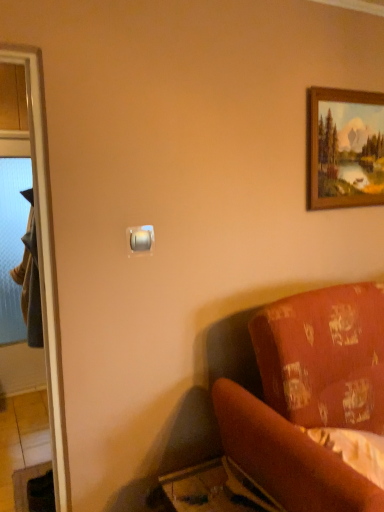
Question: Is satin gold switch at upper center inside dark gray fabric robe at left?

Choices:
 (A) yes
 (B) no

Answer: (B)

Question: Considering the relative sizes of dark gray fabric robe at left and satin gold switch at upper center in the image provided, is dark gray fabric robe at left smaller than satin gold switch at upper center?

Choices:
 (A) yes
 (B) no

Answer: (B)

Question: Is dark gray fabric robe at left at the left side of satin gold switch at upper center?

Choices:
 (A) yes
 (B) no

Answer: (A)

Question: Can you confirm if dark gray fabric robe at left is wider than satin gold switch at upper center?

Choices:
 (A) yes
 (B) no

Answer: (A)

Question: Considering the relative sizes of dark gray fabric robe at left and satin gold switch at upper center in the image provided, is dark gray fabric robe at left bigger than satin gold switch at upper center?

Choices:
 (A) no
 (B) yes

Answer: (B)

Question: Is dark gray fabric robe at left not near satin gold switch at upper center?

Choices:
 (A) yes
 (B) no

Answer: (A)

Question: From the image's perspective, is dark gray fabric robe at left under velvet-like red couch at lower right?

Choices:
 (A) yes
 (B) no

Answer: (B)

Question: Does dark gray fabric robe at left have a smaller size compared to velvet-like red couch at lower right?

Choices:
 (A) no
 (B) yes

Answer: (B)

Question: Is dark gray fabric robe at left completely or partially outside of velvet-like red couch at lower right?

Choices:
 (A) no
 (B) yes

Answer: (B)

Question: From a real-world perspective, is dark gray fabric robe at left positioned under velvet-like red couch at lower right based on gravity?

Choices:
 (A) no
 (B) yes

Answer: (A)

Question: Does dark gray fabric robe at left appear on the left side of velvet-like red couch at lower right?

Choices:
 (A) no
 (B) yes

Answer: (B)

Question: Are dark gray fabric robe at left and velvet-like red couch at lower right far apart?

Choices:
 (A) no
 (B) yes

Answer: (B)

Question: Considering the relative positions of velvet-like red couch at lower right and satin gold switch at upper center in the image provided, is velvet-like red couch at lower right behind satin gold switch at upper center?

Choices:
 (A) no
 (B) yes

Answer: (A)